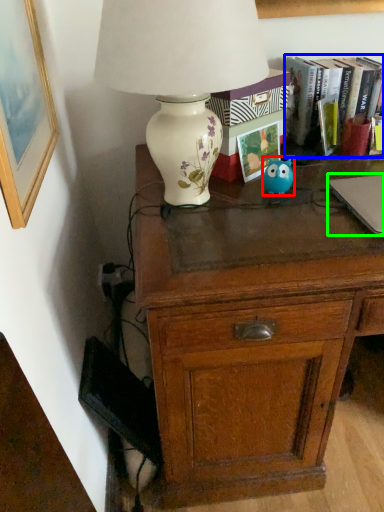
Question: Which object is positioned farthest from animal (highlighted by a red box)? Select from book (highlighted by a blue box) and laptop (highlighted by a green box).

Choices:
 (A) book
 (B) laptop

Answer: (A)